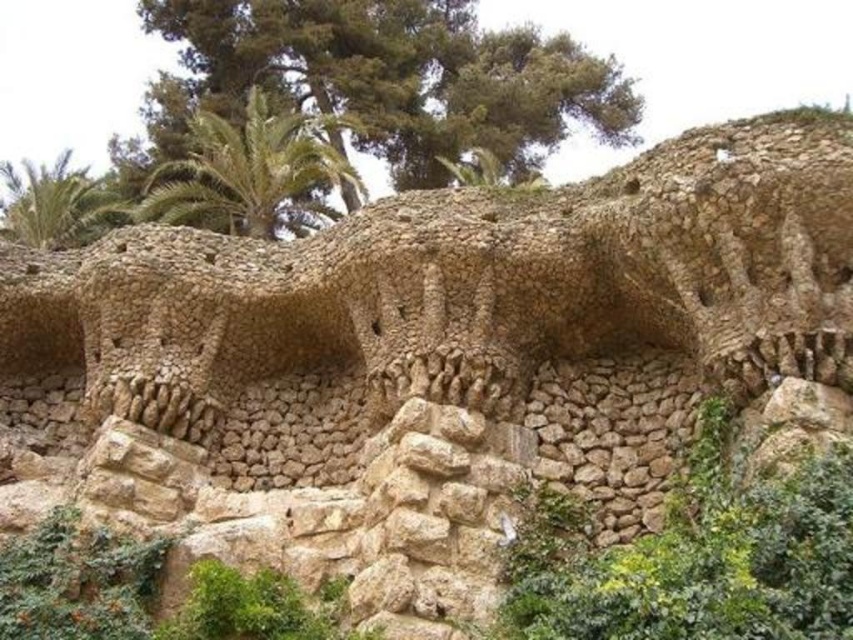
You are standing at the point marked by the coordinates point (144, 592) in the image. What do you see around you?

You are standing at the point marked by the coordinates point (144, 592), which indicates a green leafy shrub at lower left. The shrub is part of the lush vegetation surrounding the stone structure, providing a natural contrast to the earthy tones of the architecture.

You are planning to place a small garden statue that requires a base wider than 1 meter. Based on the scene, which object between the green mossy rock at center and the green leafy shrub at lower left would be suitable for placing the statue?

The green leafy shrub at lower left has a greater width than the green mossy rock at center, so the statue should be placed on the green leafy shrub at lower left since its width exceeds 1 meter.

You are standing in front of the stone structure and want to find a path that goes between the green leafy shrub at lower left and the green leafy palm tree at upper left. Based on their positions, which direction should you look to find this path?

Since the green leafy shrub at lower left is to the right of the green leafy palm tree at upper left, you should look to the right of the palm tree to find the path between them.